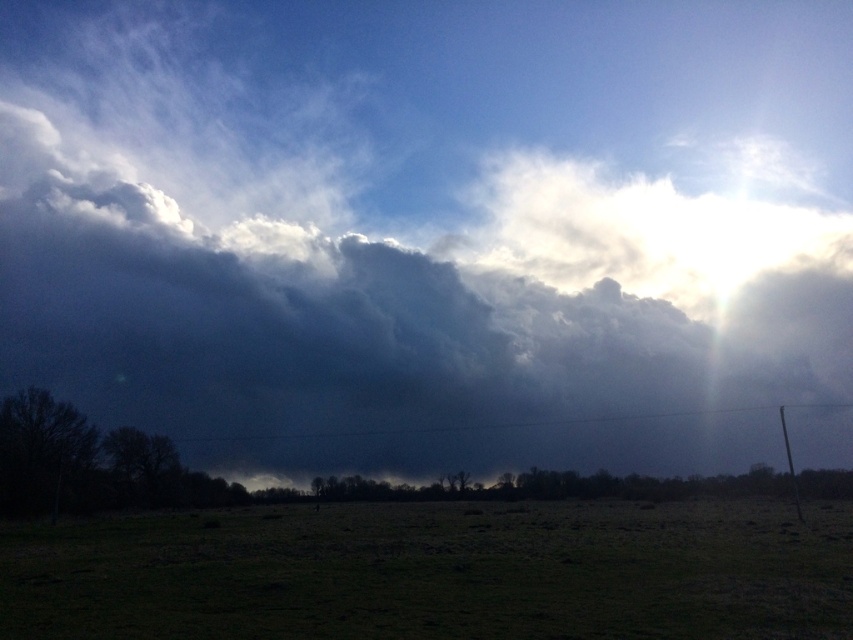
Can you confirm if dark gray cloud at upper center is positioned to the right of green grass at lower center?

Incorrect, dark gray cloud at upper center is not on the right side of green grass at lower center.

Can you confirm if dark gray cloud at upper center is wider than green grass at lower center?

Yes.

In order to click on dark gray cloud at upper center in this screenshot , I will do `click(419, 326)`.